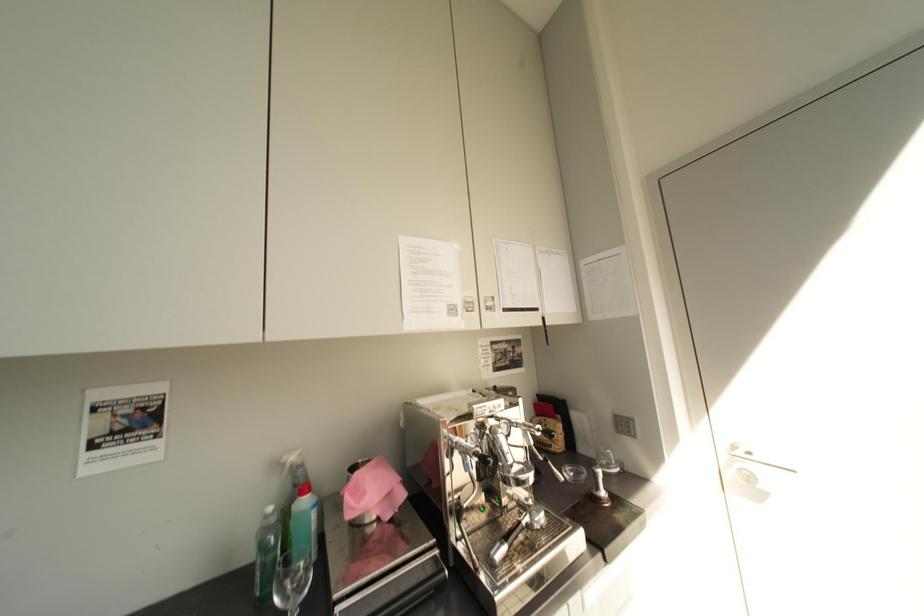
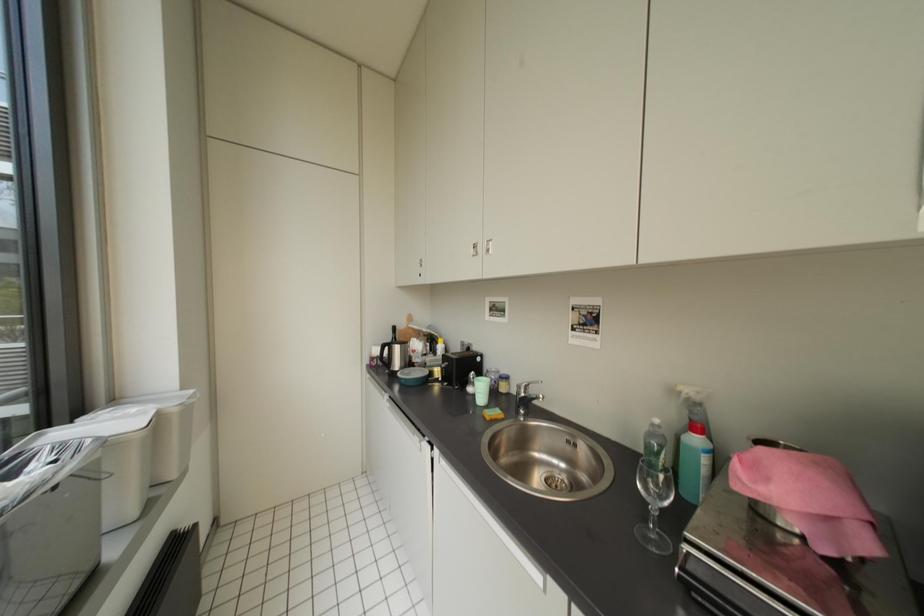
Question: The camera is either moving clockwise (left) or counter-clockwise (right) around the object. The first image is from the beginning of the video and the second image is from the end. Is the camera moving left or right when shooting the video?

Choices:
 (A) Left
 (B) Right

Answer: (B)